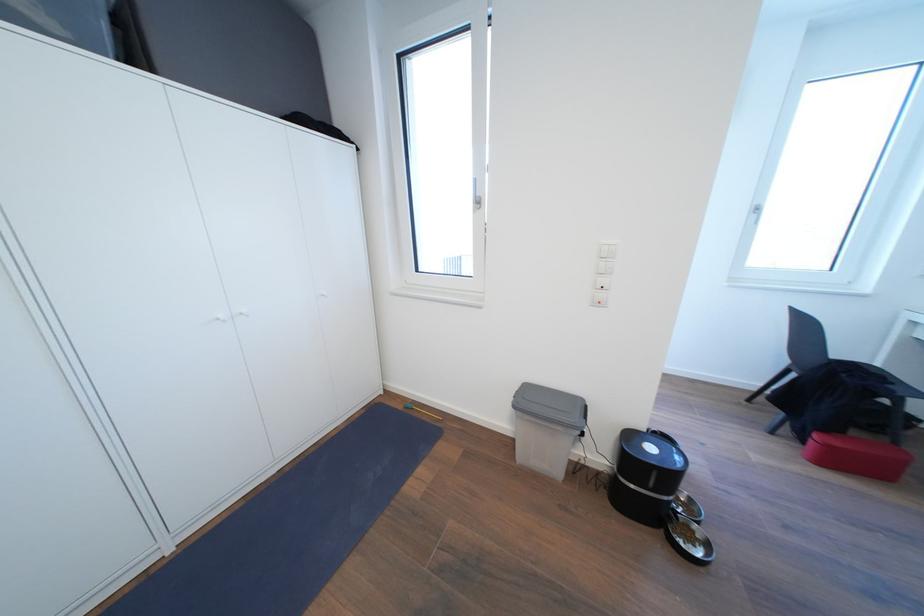
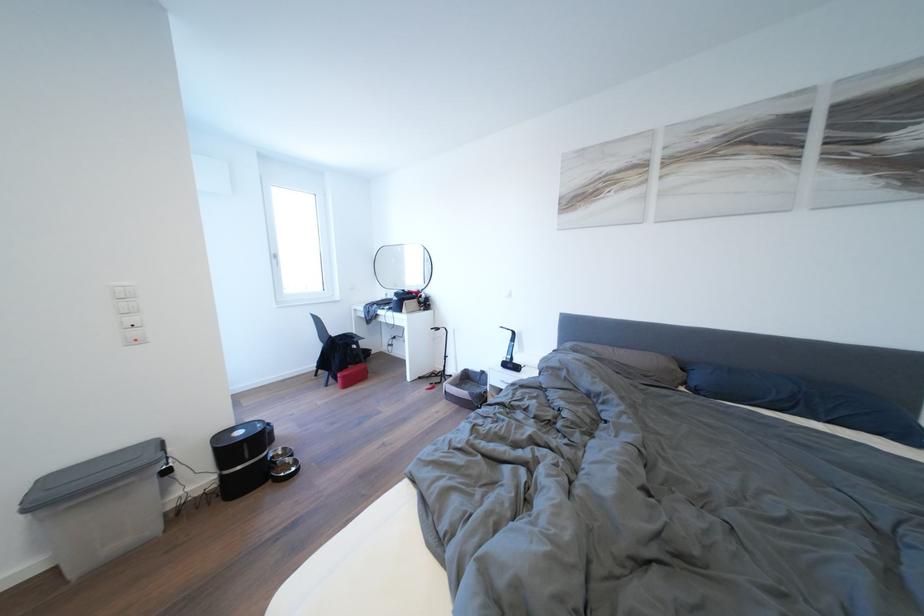
Find the pixel in the second image that matches pixel 766 214 in the first image.

(284, 261)